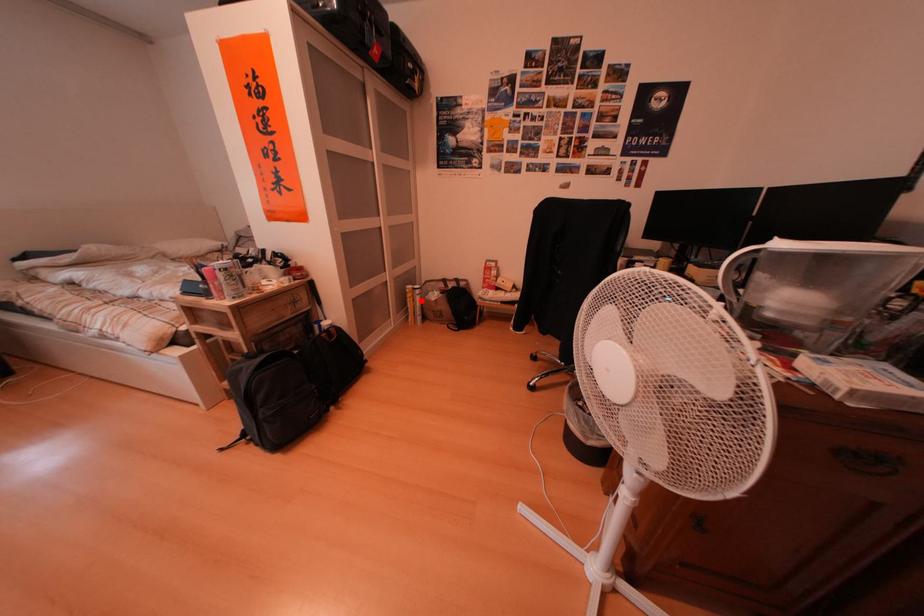
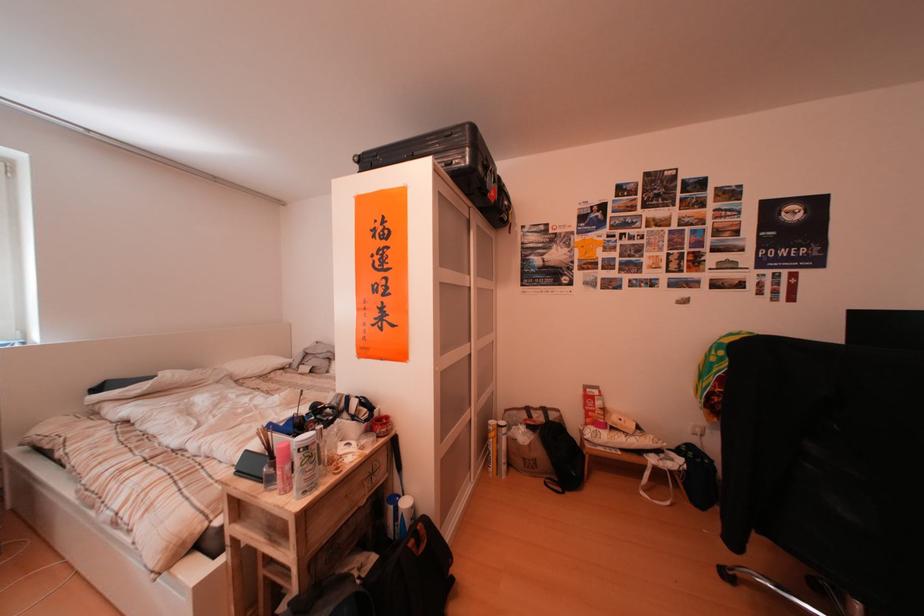
Question: A red point is marked in image1. In image2, is the corresponding 3D point closer to the camera or farther? Reply with the corresponding letter.

Choices:
 (A) The corresponding 3D point is closer.
 (B) The corresponding 3D point is farther.

Answer: (B)